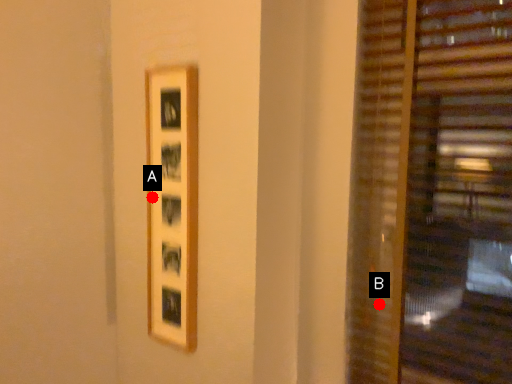
Question: Two points are circled on the image, labeled by A and B beside each circle. Which point appears farthest from the camera in this image?

Choices:
 (A) A is further
 (B) B is further

Answer: (B)